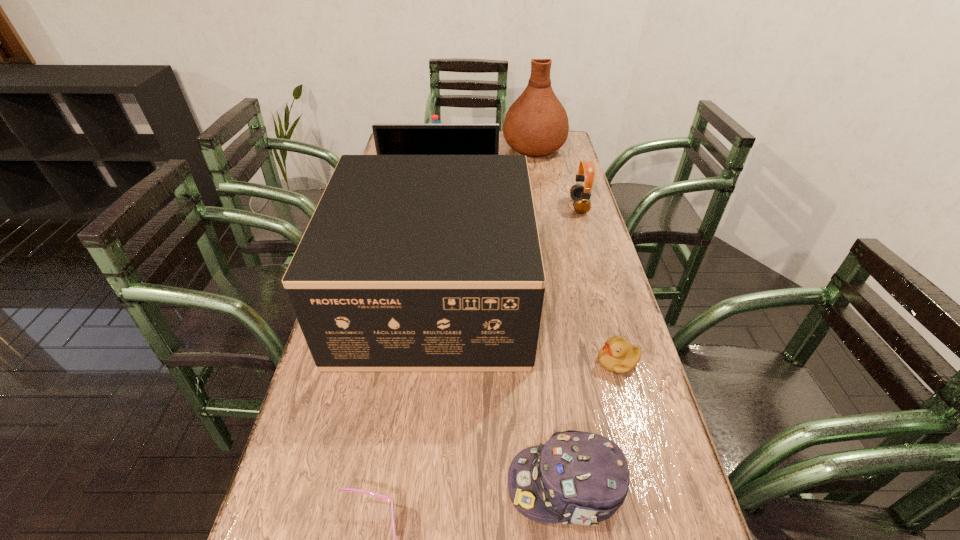
Where is `box present at the left edge`? The image size is (960, 540). box present at the left edge is located at coordinates (410, 263).

The height and width of the screenshot is (540, 960). What are the coordinates of `monitor at the left edge` in the screenshot? It's located at (390, 139).

Find the location of a particular element. This screenshot has height=540, width=960. pitcher at the right edge is located at coordinates (536, 124).

Identify the location of headset located in the right edge section of the desktop. Image resolution: width=960 pixels, height=540 pixels. (580, 194).

Where is `headwear located in the right edge section of the desktop`? headwear located in the right edge section of the desktop is located at coordinates (576, 477).

I want to click on duckling that is at the right edge, so click(x=617, y=356).

Locate an element on the screen. object that is at the far right corner is located at coordinates (536, 124).

Identify the location of free space at the left edge of the desktop. This screenshot has width=960, height=540. click(x=333, y=386).

Locate an element on the screen. vacant space at the right edge of the desktop is located at coordinates (559, 240).

In the image, there is a desktop. Identify the location of free space at the far right corner. The height and width of the screenshot is (540, 960). (561, 152).